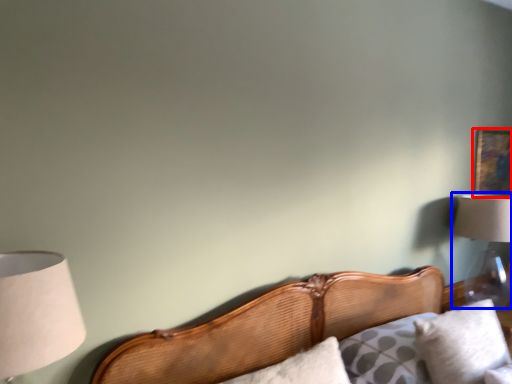
Question: Which point is closer to the camera, picture frame (highlighted by a red box) or lamp (highlighted by a blue box)?

Choices:
 (A) picture frame
 (B) lamp

Answer: (B)